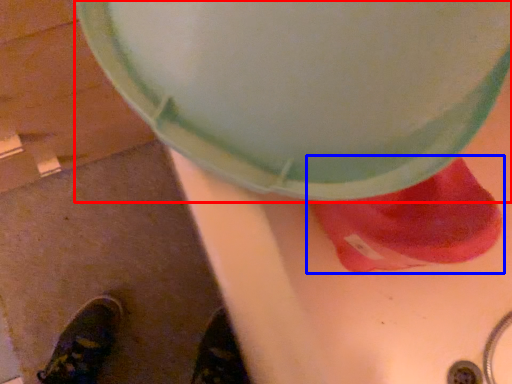
Question: Which object appears closest to the camera in this image, lid (highlighted by a red box) or footwear (highlighted by a blue box)?

Choices:
 (A) lid
 (B) footwear

Answer: (A)